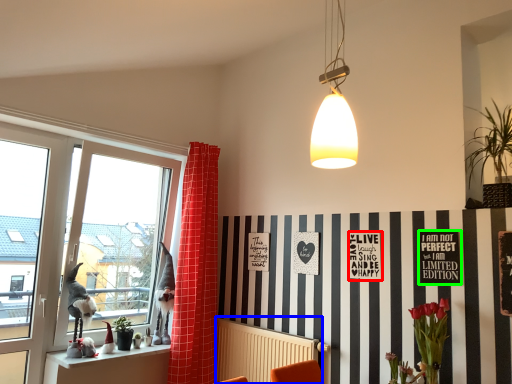
Question: Which is farther away from postcard (highlighted by a red box)? radiator (highlighted by a blue box) or bulletin board (highlighted by a green box)?

Choices:
 (A) radiator
 (B) bulletin board

Answer: (A)